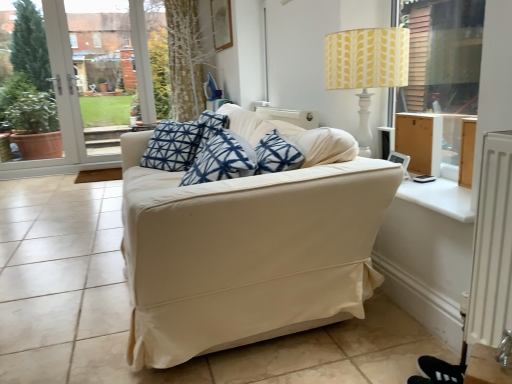
This screenshot has width=512, height=384. What do you see at coordinates (440, 198) in the screenshot? I see `white smooth window sill at right` at bounding box center [440, 198].

What do you see at coordinates (249, 245) in the screenshot? This screenshot has width=512, height=384. I see `beige fabric couch at center` at bounding box center [249, 245].

Locate an element on the screen. This screenshot has height=384, width=512. white glass door at left is located at coordinates (x=89, y=83).

Identify the location of white smooth window sill at right. This screenshot has height=384, width=512. (440, 198).

Who is bigger, white smooth window sill at right or beige fabric couch at center?

beige fabric couch at center.

Who is more distant, white smooth window sill at right or beige fabric couch at center?

white smooth window sill at right is further from the camera.

From a real-world perspective, which is physically above, white smooth window sill at right or beige fabric couch at center?

From a 3D spatial view, white smooth window sill at right is above.

Locate an element on the screen. This screenshot has width=512, height=384. table lamp above the white smooth window sill at right (from the image's perspective) is located at coordinates pyautogui.click(x=366, y=67).

Would you say white smooth window sill at right is a long distance from yellow fabric lampshade at upper right?

white smooth window sill at right is near yellow fabric lampshade at upper right, not far away.

Considering the relative positions of white smooth window sill at right and yellow fabric lampshade at upper right in the image provided, is white smooth window sill at right to the left or to the right of yellow fabric lampshade at upper right?

In the image, white smooth window sill at right appears on the right side of yellow fabric lampshade at upper right.

Is white smooth window sill at right further to the viewer compared to yellow fabric lampshade at upper right?

No, it is not.

Which is behind, point (70, 85) or point (470, 193)?

The point (70, 85) is behind.

Between white glass door at left and white smooth window sill at right, which one has larger width?

Wider between the two is white smooth window sill at right.

Considering the relative positions of white glass door at left and white smooth window sill at right in the image provided, is white glass door at left to the left or to the right of white smooth window sill at right?

white glass door at left is positioned on white smooth window sill at right's left side.

Is yellow fabric lampshade at upper right next to white smooth window sill at right?

Answer: yellow fabric lampshade at upper right and white smooth window sill at right are not in contact.

Who is shorter, yellow fabric lampshade at upper right or white smooth window sill at right?

With less height is white smooth window sill at right.

What's the angular difference between yellow fabric lampshade at upper right and white smooth window sill at right's facing directions?

yellow fabric lampshade at upper right and white smooth window sill at right are facing 0.000449 degrees away from each other.

Is yellow fabric lampshade at upper right looking in the opposite direction of white smooth window sill at right?

No, yellow fabric lampshade at upper right is not facing away from white smooth window sill at right.

How far apart are beige fabric couch at center and white glass door at left?

beige fabric couch at center and white glass door at left are 13.33 feet apart from each other.

Looking at this image, which of these two, beige fabric couch at center or white glass door at left, is wider?

With larger width is beige fabric couch at center.

Is beige fabric couch at center in contact with white glass door at left?

No, beige fabric couch at center is not with white glass door at left.

How different are the orientations of beige fabric couch at center and white glass door at left in degrees?

89 degrees.

Does yellow fabric lampshade at upper right have a lesser width compared to beige fabric couch at center?

Yes, yellow fabric lampshade at upper right is thinner than beige fabric couch at center.

Does point (382, 65) lie behind point (183, 188)?

Yes, point (382, 65) is behind point (183, 188).

Considering the positions of objects yellow fabric lampshade at upper right and beige fabric couch at center in the image provided, who is behind, yellow fabric lampshade at upper right or beige fabric couch at center?

yellow fabric lampshade at upper right is further from the camera.

Are yellow fabric lampshade at upper right and white glass door at left beside each other?

yellow fabric lampshade at upper right and white glass door at left are clearly separated.

From a real-world perspective, is yellow fabric lampshade at upper right located beneath white glass door at left?

Yes, from a real-world perspective, yellow fabric lampshade at upper right is under white glass door at left.

Considering the relative sizes of yellow fabric lampshade at upper right and white glass door at left in the image provided, is yellow fabric lampshade at upper right smaller than white glass door at left?

Yes.

In the scene shown: From the image's perspective, is yellow fabric lampshade at upper right located beneath white glass door at left?

Yes.

You are a GUI agent. You are given a task and a screenshot of the screen. Output one action in this format:
    pyautogui.click(x=<x>, y=<y>)
    Task: Click on the window sill lying below the beige fabric couch at center (from the image's perspective)
    This screenshot has width=512, height=384.
    Given the screenshot: What is the action you would take?
    pyautogui.click(x=440, y=198)

Where is `table lamp positioned vertically above the white smooth window sill at right (from a real-world perspective)`? This screenshot has height=384, width=512. table lamp positioned vertically above the white smooth window sill at right (from a real-world perspective) is located at coordinates (366, 67).

Considering their positions, is white glass door at left positioned further to yellow fabric lampshade at upper right than beige fabric couch at center?

white glass door at left is positioned further to the anchor yellow fabric lampshade at upper right.

Estimate the real-world distances between objects in this image. Which object is further from white smooth window sill at right, white glass door at left or beige fabric couch at center?

white glass door at left is positioned further to the anchor white smooth window sill at right.

Estimate the real-world distances between objects in this image. Which object is further from white glass door at left, beige fabric couch at center or yellow fabric lampshade at upper right?

beige fabric couch at center.

Based on their spatial positions, is yellow fabric lampshade at upper right or white smooth window sill at right further from beige fabric couch at center?

yellow fabric lampshade at upper right lies further to beige fabric couch at center than the other object.

Estimate the real-world distances between objects in this image. Which object is closer to white glass door at left, white smooth window sill at right or yellow fabric lampshade at upper right?

yellow fabric lampshade at upper right lies closer to white glass door at left than the other object.

Considering their positions, is yellow fabric lampshade at upper right positioned further to white glass door at left than white smooth window sill at right?

Among the two, white smooth window sill at right is located further to white glass door at left.

When comparing their distances from white smooth window sill at right, does beige fabric couch at center or white glass door at left seem further?

Based on the image, white glass door at left appears to be further to white smooth window sill at right.

From the image, which object appears to be nearer to white glass door at left, yellow fabric lampshade at upper right or beige fabric couch at center?

yellow fabric lampshade at upper right is closer to white glass door at left.

Locate an element on the screen. table lamp between beige fabric couch at center and white glass door at left along the z-axis is located at coordinates (366, 67).

The height and width of the screenshot is (384, 512). I want to click on window sill between beige fabric couch at center and white glass door at left in the front-back direction, so click(440, 198).

Locate an element on the screen. The image size is (512, 384). table lamp between white smooth window sill at right and white glass door at left from front to back is located at coordinates (366, 67).

The height and width of the screenshot is (384, 512). Identify the location of table lamp situated between beige fabric couch at center and white smooth window sill at right from left to right. (366, 67).